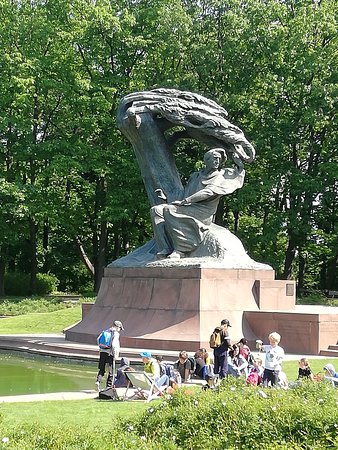
Where is `statue`? This screenshot has height=450, width=338. statue is located at coordinates (213, 258).